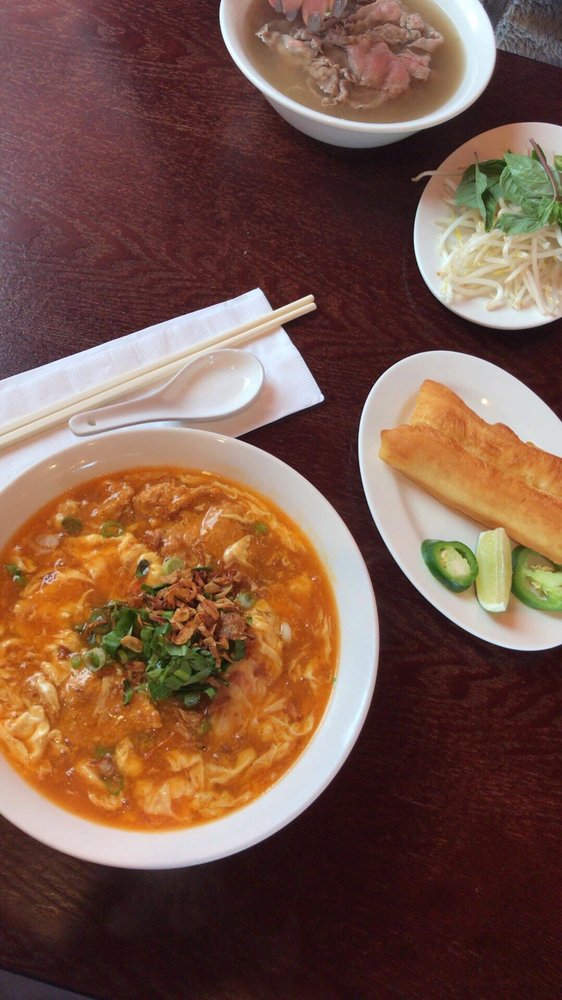
Where is `table`? The width and height of the screenshot is (562, 1000). table is located at coordinates (478, 868).